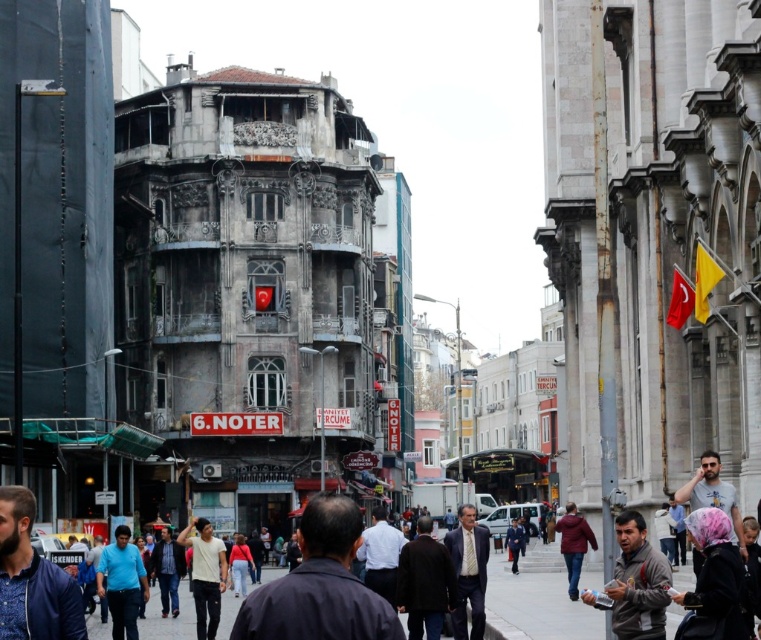
Question: Does blue shirt at center appear on the right side of dark red jacket at center?

Choices:
 (A) yes
 (B) no

Answer: (B)

Question: Can you confirm if blue shirt at center is thinner than dark red jacket at center?

Choices:
 (A) no
 (B) yes

Answer: (A)

Question: Observing the image, what is the correct spatial positioning of blue shirt at lower left in reference to blue shirt at center?

Choices:
 (A) above
 (B) below

Answer: (A)

Question: Which point appears farthest from the camera in this image?

Choices:
 (A) (639, 632)
 (B) (196, 608)
 (C) (330, 577)

Answer: (B)

Question: Which object is positioned farthest from the dark blue shirt at center?

Choices:
 (A) dark red jacket at center
 (B) gray fleece jacket at lower right

Answer: (A)

Question: Among these points, which one is farthest from the camera?

Choices:
 (A) (482, 538)
 (B) (581, 547)
 (C) (253, 595)
 (D) (651, 618)

Answer: (B)